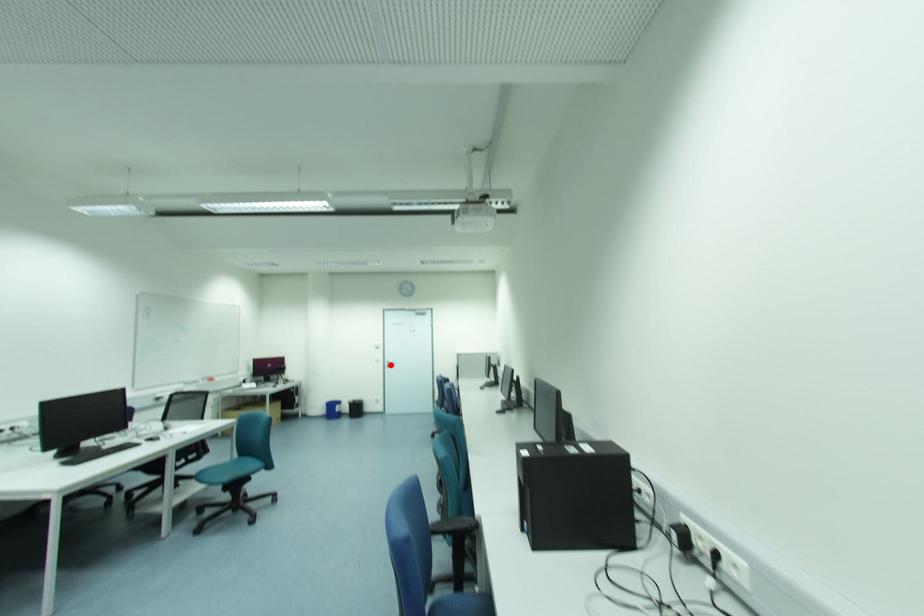
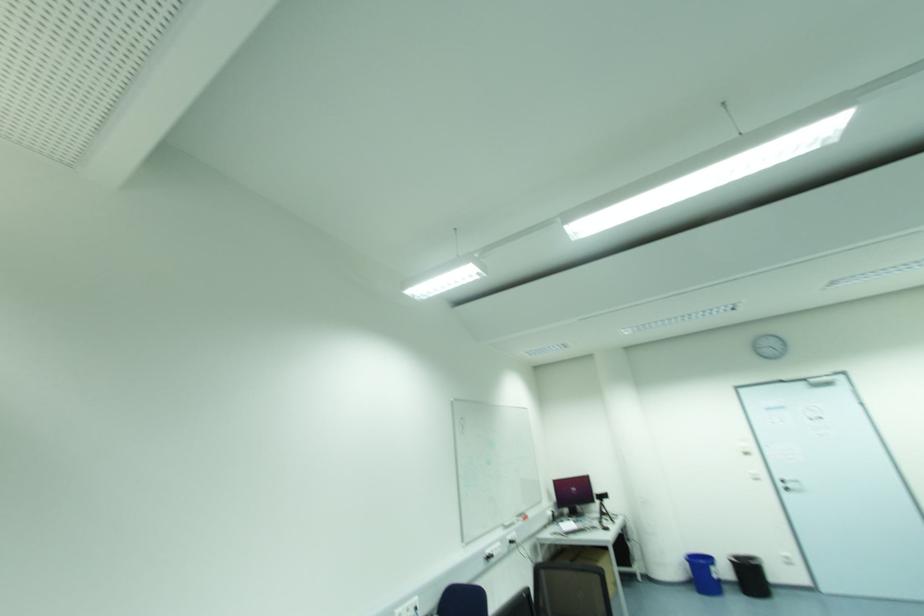
The point at the highlighted location is marked in the first image. Where is the corresponding point in the second image?

(789, 485)